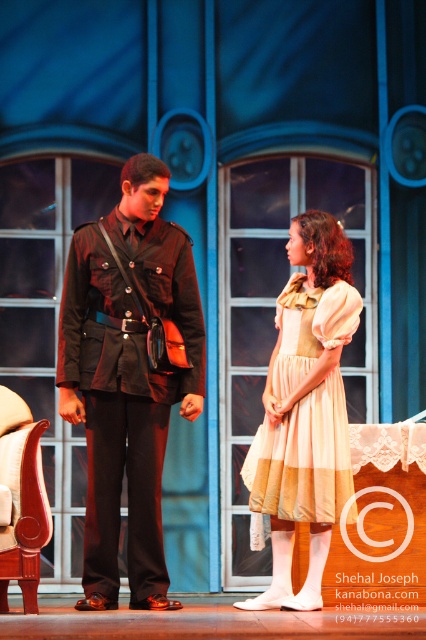
Can you confirm if matte black uniform at center is bigger than striped cotton dress at center?

Indeed, matte black uniform at center has a larger size compared to striped cotton dress at center.

Describe the element at coordinates (127, 378) in the screenshot. I see `matte black uniform at center` at that location.

The width and height of the screenshot is (426, 640). I want to click on matte black uniform at center, so click(x=127, y=378).